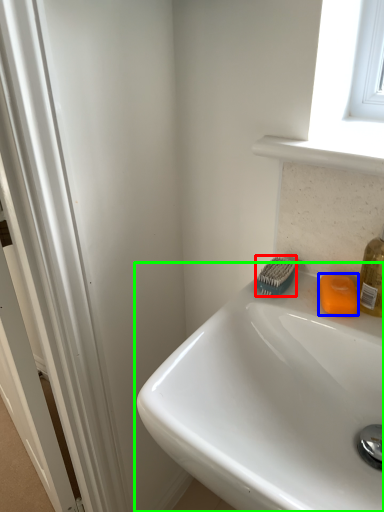
Question: Considering the real-world distances, which object is closest to brush (highlighted by a red box)? soap (highlighted by a blue box) or sink (highlighted by a green box).

Choices:
 (A) soap
 (B) sink

Answer: (A)